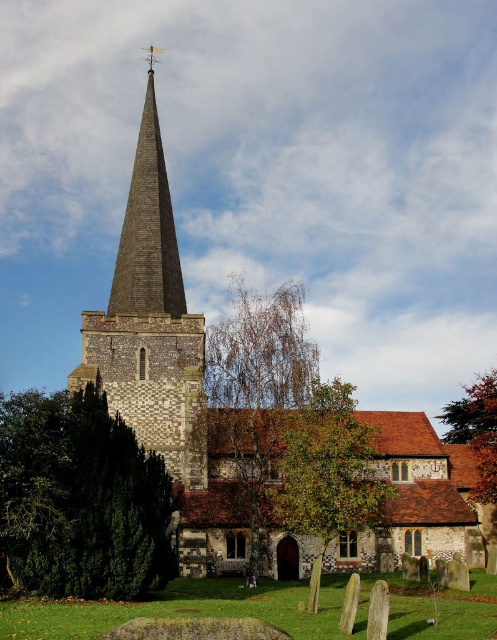
Image resolution: width=497 pixels, height=640 pixels. What are the coordinates of `green leafy tree at center` in the screenshot? It's located at (328, 472).

Who is more forward, (298, 428) or (115, 300)?

Positioned in front is point (298, 428).

Does point (310, 492) lie behind point (148, 164)?

No, (310, 492) is in front of (148, 164).

I want to click on green leafy tree at center, so click(x=328, y=472).

From the picture: Can you confirm if brown textured tree at center is taller than brown textured tree at upper right?

Yes, brown textured tree at center is taller than brown textured tree at upper right.

Is point (258, 500) less distant than point (484, 401)?

Yes, it is in front of point (484, 401).

Locate an element on the screen. brown textured tree at center is located at coordinates (256, 388).

Does brown textured tree at center have a greater width compared to dark brown shingles spire at upper center?

Correct, the width of brown textured tree at center exceeds that of dark brown shingles spire at upper center.

Is brown textured tree at center to the left of dark brown shingles spire at upper center from the viewer's perspective?

No, brown textured tree at center is not to the left of dark brown shingles spire at upper center.

The image size is (497, 640). I want to click on brown textured tree at center, so click(x=256, y=388).